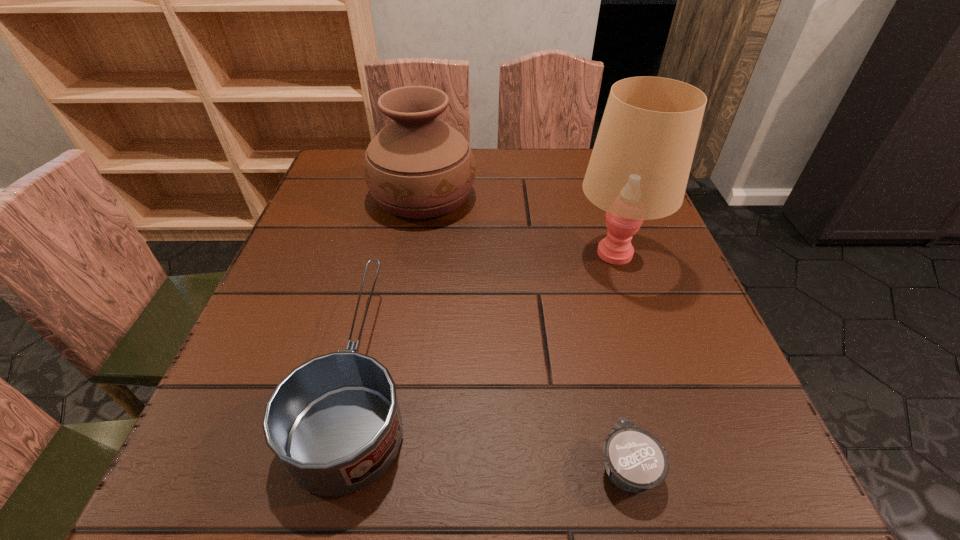
The image size is (960, 540). I want to click on blank region between the tallest object and the second shortest object, so click(x=488, y=313).

At what (x,y) coordinates should I click in order to perform the action: click on vacant space that is in between the shortest object and the second shortest object. Please return your answer as a coordinate pair (x, y). The image size is (960, 540). Looking at the image, I should click on (493, 420).

Find the location of a particular element. empty space between the saucepan and the urn is located at coordinates (392, 285).

I want to click on free area in between the third shortest object and the saucepan, so click(x=392, y=285).

Find the location of a particular element. This screenshot has width=960, height=540. vacant area that lies between the shortest object and the lampshade is located at coordinates (621, 359).

The image size is (960, 540). What are the coordinates of `object that is the third closest to the saucepan` in the screenshot? It's located at (640, 164).

Identify which object is the closest to the tallest object. Please provide its 2D coordinates. Your answer should be formatted as a tuple, i.e. [(x, y)], where the tuple contains the x and y coordinates of a point satisfying the conditions above.

[(419, 167)]

Identify the location of blank area in the image that satisfies the following two spatial constraints: 1. on the front side of the second tallest object; 2. on the right side of the tallest object. The height and width of the screenshot is (540, 960). (414, 252).

At what (x,y) coordinates should I click in order to perform the action: click on vacant area in the image that satisfies the following two spatial constraints: 1. on the back side of the yogurt; 2. on the right side of the tallest object. Please return your answer as a coordinate pair (x, y). The image size is (960, 540). Looking at the image, I should click on (576, 252).

What are the coordinates of `free space in the image that satisfies the following two spatial constraints: 1. with the handle extending from one side of the saucepan; 2. on the right side of the lampshade` in the screenshot? It's located at (389, 252).